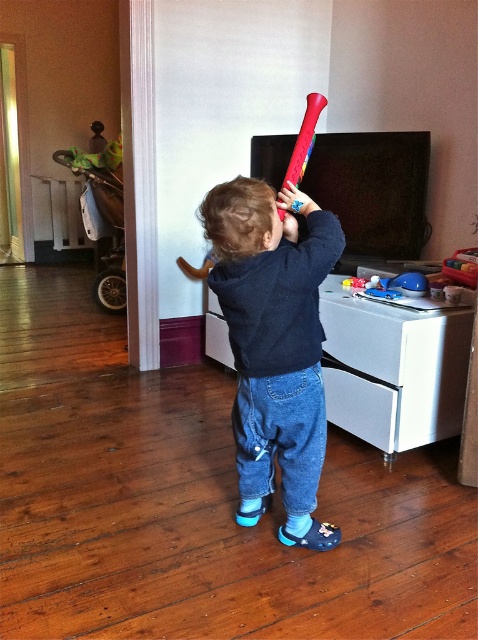
Does brown matte hair at center appear on the left side of rubberized red baseball bat at upper center?

Yes, brown matte hair at center is to the left of rubberized red baseball bat at upper center.

Which is behind, point (259, 186) or point (280, 212)?

The point (280, 212) is behind.

The height and width of the screenshot is (640, 478). What are the coordinates of `brown matte hair at center` in the screenshot? It's located at (241, 218).

Who is lower down, matte plastic bat at center or rubberized red baseball bat at upper center?

matte plastic bat at center

Does matte plastic bat at center have a smaller size compared to rubberized red baseball bat at upper center?

No, matte plastic bat at center is not smaller than rubberized red baseball bat at upper center.

This screenshot has height=640, width=478. Find the location of `matte plastic bat at center`. matte plastic bat at center is located at coordinates (274, 346).

Who is higher up, matte plastic bat at center or brown matte hair at center?

Positioned higher is brown matte hair at center.

Is matte plastic bat at center taller than brown matte hair at center?

Indeed, matte plastic bat at center has a greater height compared to brown matte hair at center.

Which is in front, point (242, 385) or point (250, 198)?

Point (250, 198)

Find the location of a particular element. matte plastic bat at center is located at coordinates (274, 346).